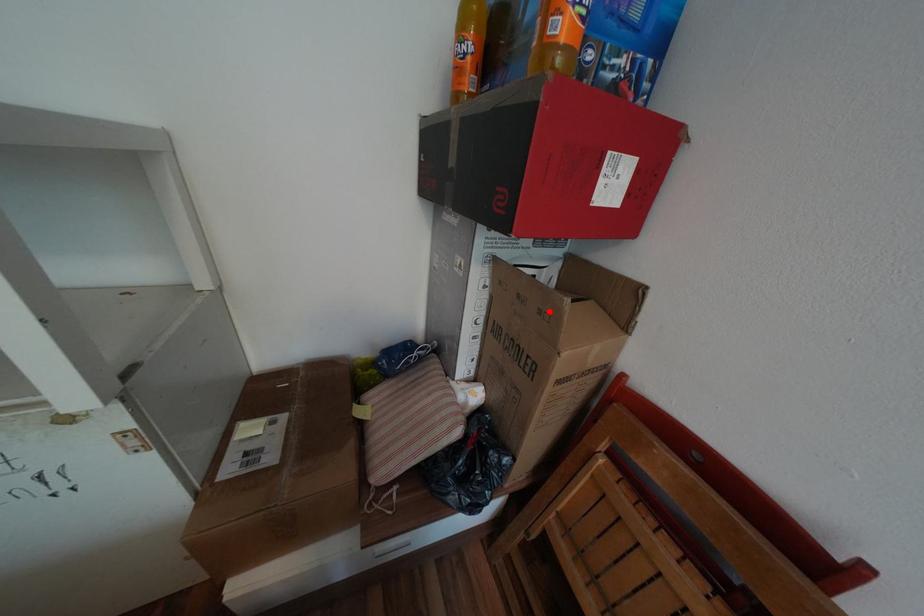
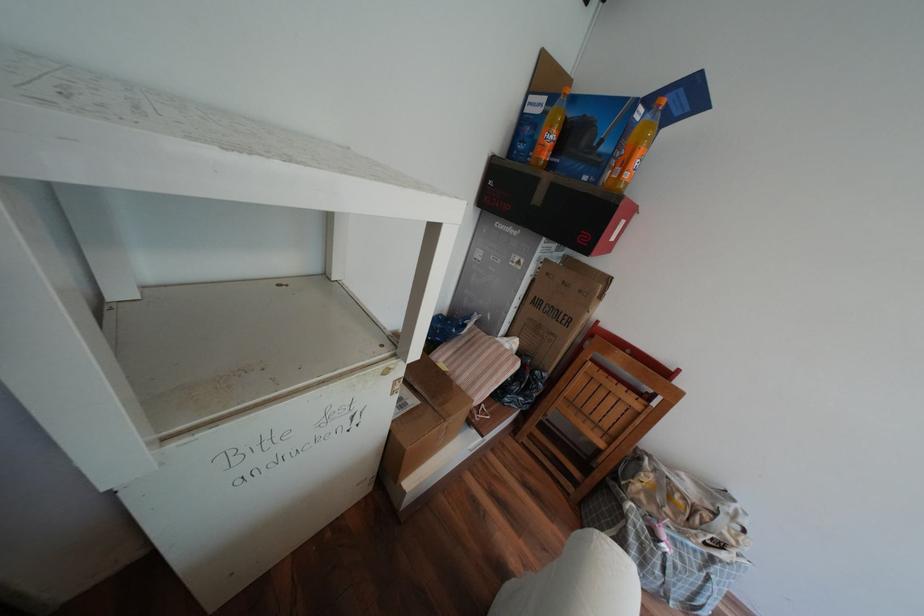
Find the pixel in the second image that matches the highlighted location in the first image.

(590, 291)